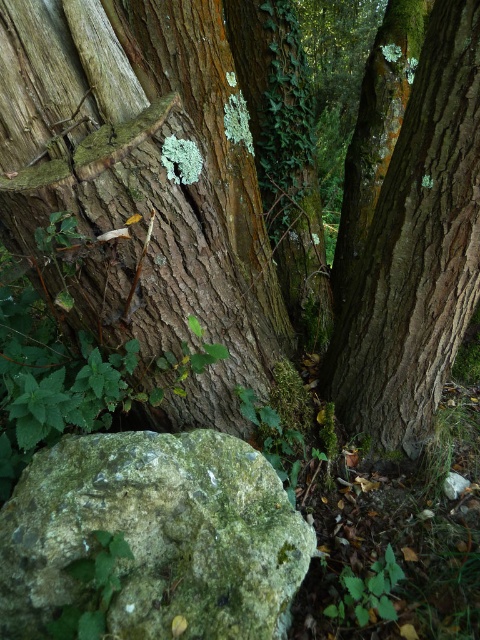
How distant is rough bark tree at center from smooth brown bark at center?

rough bark tree at center is 11.11 inches away from smooth brown bark at center.

Does rough bark tree at center have a lesser width compared to smooth brown bark at center?

In fact, rough bark tree at center might be wider than smooth brown bark at center.

You are a GUI agent. You are given a task and a screenshot of the screen. Output one action in this format:
    pyautogui.click(x=<x>, y=<y>)
    Task: Click on the rough bark tree at center
    
    Given the screenshot: What is the action you would take?
    pyautogui.click(x=165, y=168)

Identify the location of rough bark tree at center. This screenshot has height=640, width=480. [x=165, y=168].

Which is behind, point (152, 189) or point (34, 624)?

Positioned behind is point (152, 189).

Who is positioned more to the left, rough bark tree at center or green mossy rock at lower left?

green mossy rock at lower left

Which is in front, point (409, 358) or point (10, 637)?

Positioned in front is point (10, 637).

In order to click on rough bark tree at center in this screenshot , I will do `click(165, 168)`.

Between point (232, 481) and point (391, 168), which one is positioned in front?

Point (232, 481) is in front.

Is green mossy rock at lower left bigger than smooth brown bark at center?

No, green mossy rock at lower left is not bigger than smooth brown bark at center.

Image resolution: width=480 pixels, height=640 pixels. In order to click on green mossy rock at lower left in this screenshot , I will do `click(155, 536)`.